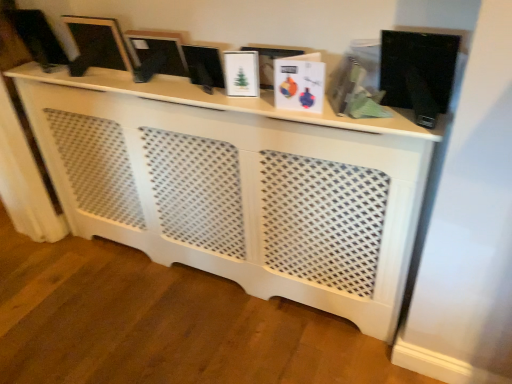
Where is `empty space that is ontop of matte black monitor at upper left, which is the 1th computer monitor in left-to-right order (from a real-world perspective)`? The image size is (512, 384). empty space that is ontop of matte black monitor at upper left, which is the 1th computer monitor in left-to-right order (from a real-world perspective) is located at coordinates (26, 3).